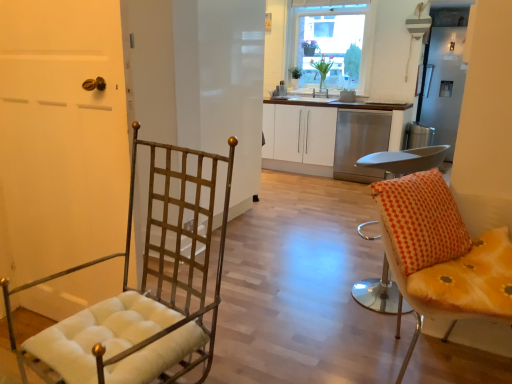
The image size is (512, 384). I want to click on vacant space behind orange fabric cushioned stool at right, arranged as the 2th chair when viewed from the right, so click(x=347, y=270).